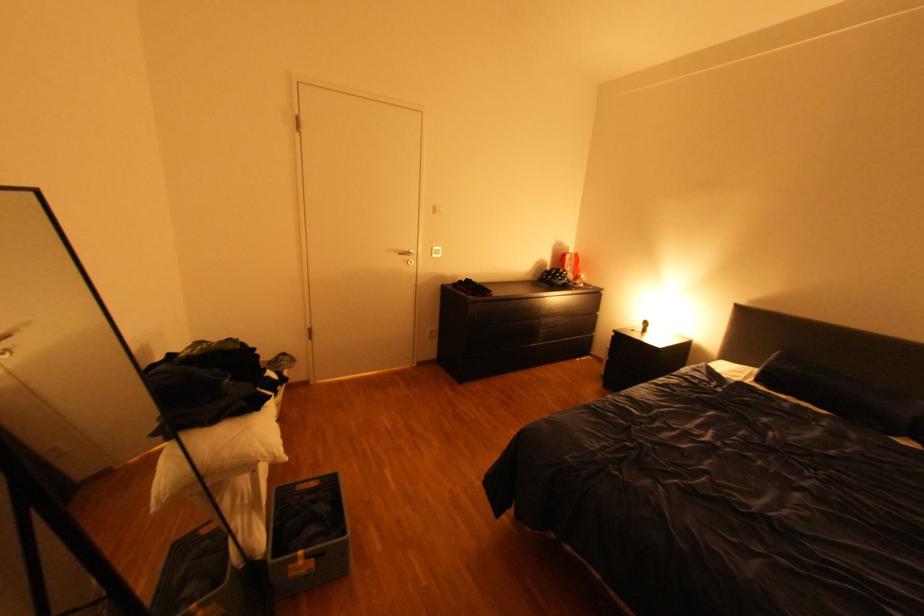
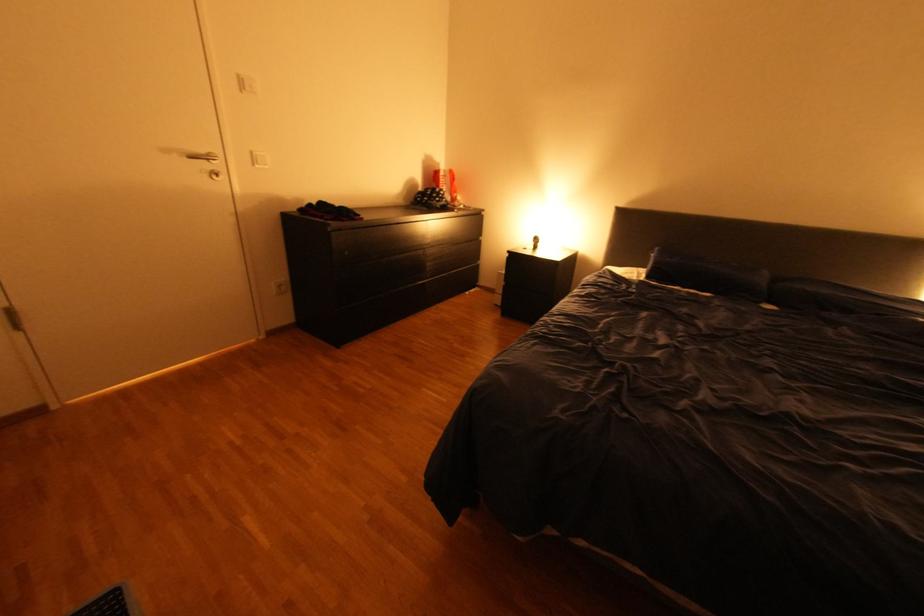
Question: How did the camera likely rotate?

Choices:
 (A) Left
 (B) Right
 (C) Up
 (D) Down

Answer: (B)